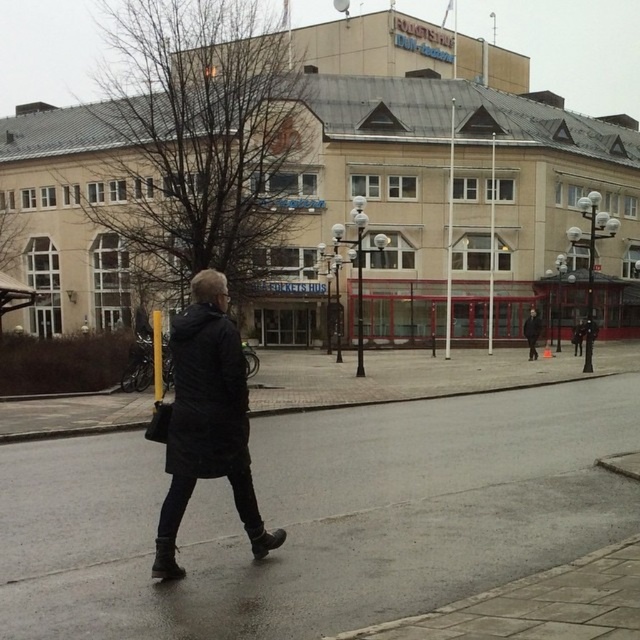
What is the location of the dark gray asphalt at center in the image?

The dark gray asphalt at center is located at point (x=324, y=512).

You are a delivery person who needs to place a large package on the ground. The package is as wide as the dark gray asphalt at center. Can you place it without overlapping the black matte coat at center?

The dark gray asphalt at center is wider than the black matte coat at center, so yes, you can place the package on the dark gray asphalt at center without overlapping the black matte coat at center.